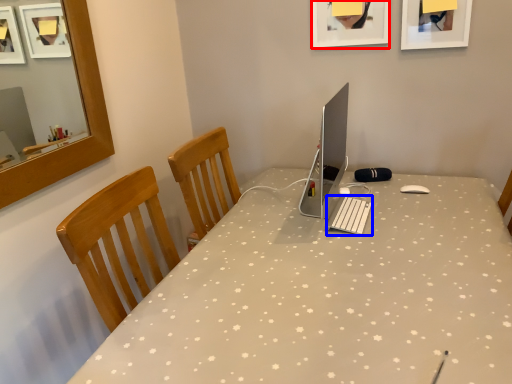
Question: Which object appears farthest to the camera in this image, picture frame (highlighted by a red box) or laptop keyboard (highlighted by a blue box)?

Choices:
 (A) picture frame
 (B) laptop keyboard

Answer: (A)